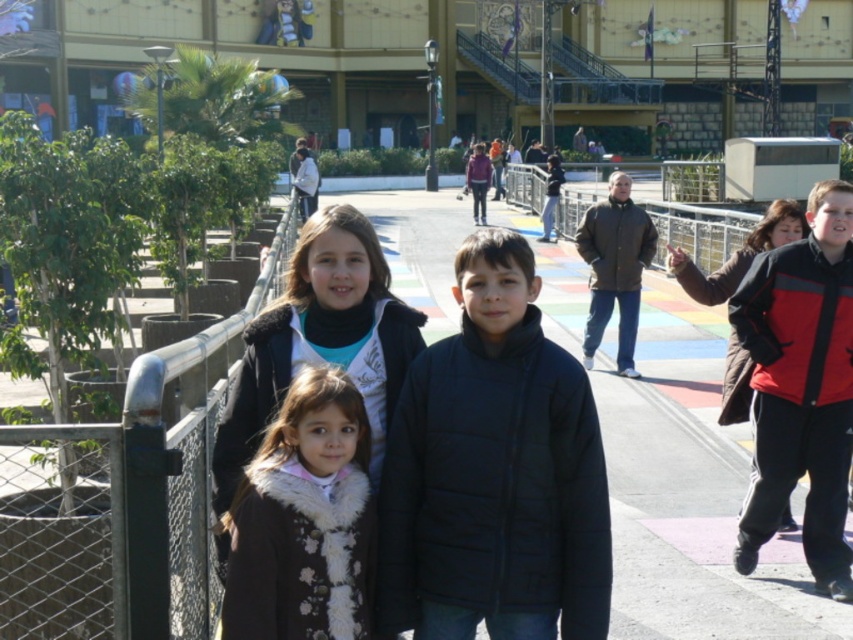
Is red and black jacket at right to the left of white fur coat at center from the viewer's perspective?

Incorrect, red and black jacket at right is not on the left side of white fur coat at center.

From the picture: Which of these two, red and black jacket at right or white fur coat at center, stands taller?

With more height is red and black jacket at right.

Between point (781, 500) and point (318, 566), which one is positioned in front?

Point (318, 566) is in front.

The height and width of the screenshot is (640, 853). In order to click on red and black jacket at right in this screenshot , I will do `click(801, 387)`.

Looking at this image, who is lower down, multicolored painted pavement at center or black quilted jacket at center?

black quilted jacket at center is below.

Is multicolored painted pavement at center to the left of black quilted jacket at center from the viewer's perspective?

Indeed, multicolored painted pavement at center is positioned on the left side of black quilted jacket at center.

Is point (662, 477) in front of point (496, 540)?

That is False.

Where is `multicolored painted pavement at center`? multicolored painted pavement at center is located at coordinates (125, 500).

How far apart are black quilted jacket at center and metallic silver fence at upper center?

51.00 feet

Between black quilted jacket at center and metallic silver fence at upper center, which one has less height?

With less height is black quilted jacket at center.

In the scene shown: Who is more forward, (508, 390) or (508, 172)?

Point (508, 390)

Locate an element on the screen. black quilted jacket at center is located at coordinates (494, 472).